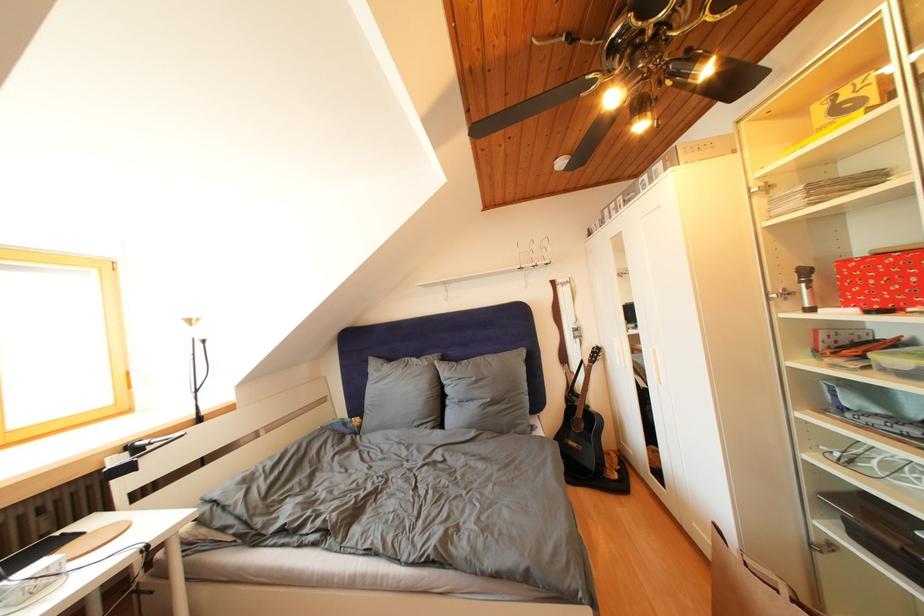
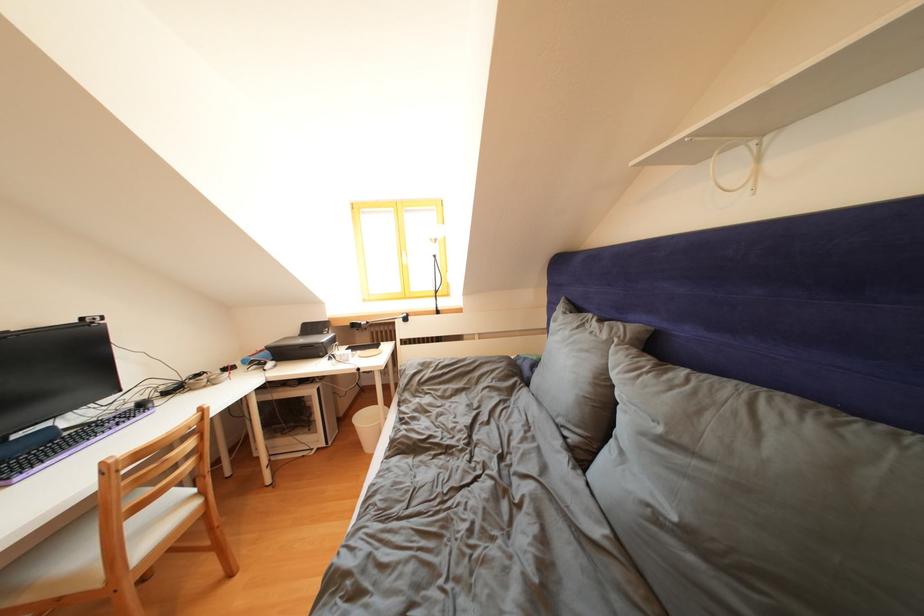
The point at (482,384) is marked in the first image. Where is the corresponding point in the second image?

(667, 435)